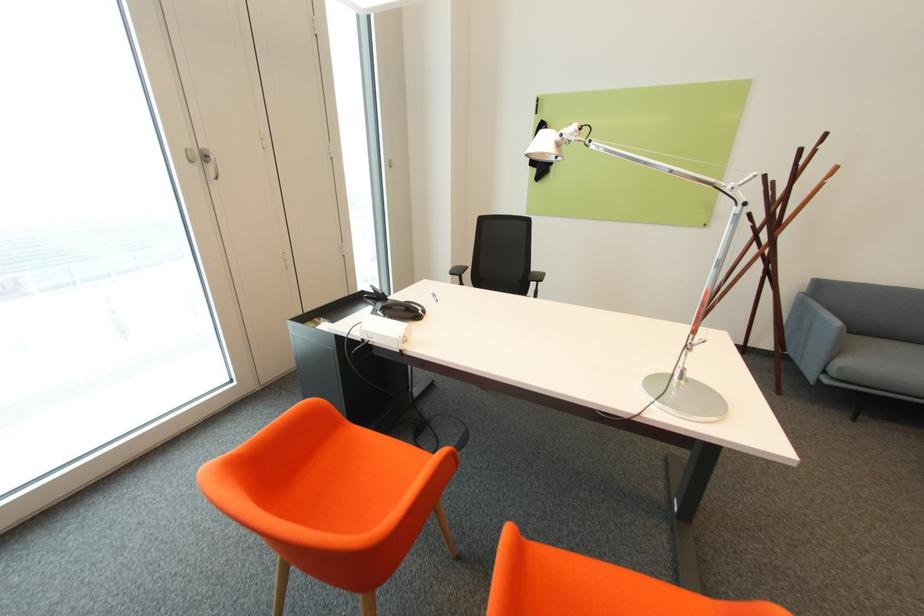
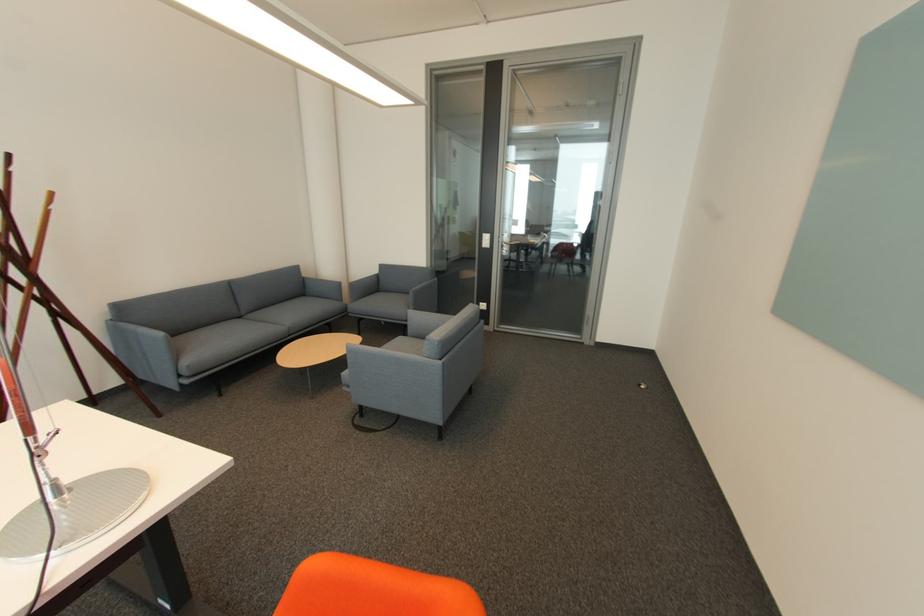
Consider the image. How did the camera likely rotate?

The camera's rotation is toward right-down.